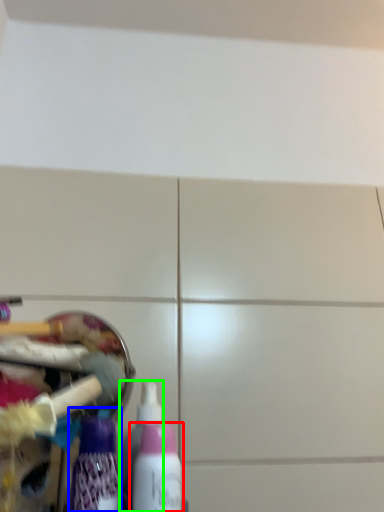
Question: Estimate the real-world distances between objects in this image. Which object is closer to bottle (highlighted by a red box), bottle (highlighted by a blue box) or bottle (highlighted by a green box)?

Choices:
 (A) bottle
 (B) bottle

Answer: (A)